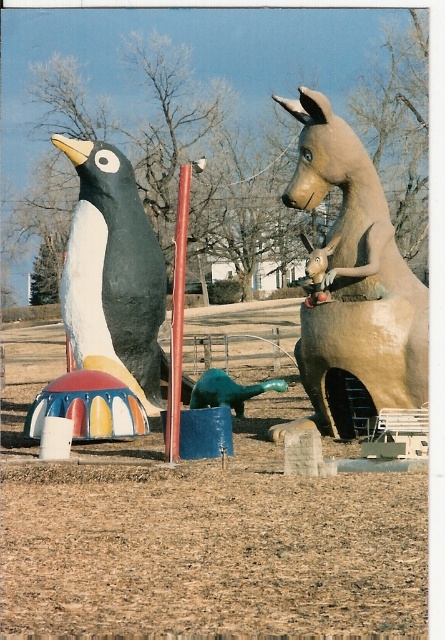
Question: Does matte black penguin at left have a lesser width compared to smooth red pole at center?

Choices:
 (A) no
 (B) yes

Answer: (B)

Question: Which point appears closest to the camera in this image?

Choices:
 (A) (176, 353)
 (B) (142, 364)

Answer: (A)

Question: Can you confirm if matte clay horse at upper right is bigger than smooth red pole at center?

Choices:
 (A) yes
 (B) no

Answer: (A)

Question: Among these points, which one is farthest from the camera?

Choices:
 (A) (183, 291)
 (B) (407, 342)
 (C) (153, 260)

Answer: (C)

Question: Which of the following is the farthest from the observer?

Choices:
 (A) (335, 141)
 (B) (145, 326)

Answer: (B)

Question: Is matte black penguin at left to the right of smooth red pole at center from the viewer's perspective?

Choices:
 (A) no
 (B) yes

Answer: (B)